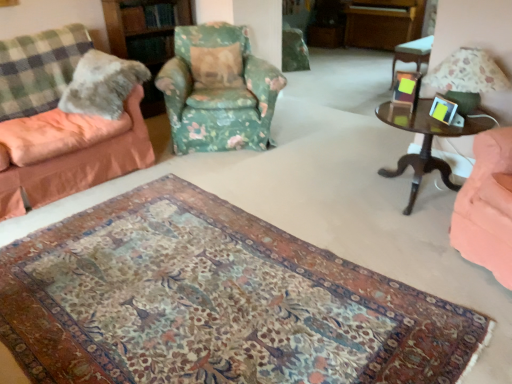
Question: Should I look upward or downward to see green checkered blanket at left?

Choices:
 (A) up
 (B) down

Answer: (A)

Question: Would you say green checkered blanket at left is outside fluffy fabric couch at left, which ranks as the second chair in right-to-left order?

Choices:
 (A) no
 (B) yes

Answer: (A)

Question: Is green checkered blanket at left further to camera compared to fluffy fabric couch at left, the first chair from the left?

Choices:
 (A) no
 (B) yes

Answer: (B)

Question: Considering the relative positions of green checkered blanket at left and fluffy fabric couch at left, which ranks as the second chair in right-to-left order, in the image provided, is green checkered blanket at left to the left of fluffy fabric couch at left, which ranks as the second chair in right-to-left order, from the viewer's perspective?

Choices:
 (A) no
 (B) yes

Answer: (B)

Question: From a real-world perspective, is green checkered blanket at left positioned under fluffy fabric couch at left, the first chair from the left, based on gravity?

Choices:
 (A) no
 (B) yes

Answer: (A)

Question: From a real-world perspective, is green checkered blanket at left over fluffy fabric couch at left, the first chair from the left?

Choices:
 (A) no
 (B) yes

Answer: (B)

Question: Is green checkered blanket at left at the right side of fluffy fabric couch at left, the first chair from the left?

Choices:
 (A) yes
 (B) no

Answer: (B)

Question: Can you confirm if green checkered blanket at left is shorter than green floral fabric bookshelf at upper center?

Choices:
 (A) no
 (B) yes

Answer: (B)

Question: Is green checkered blanket at left taller than green floral fabric bookshelf at upper center?

Choices:
 (A) no
 (B) yes

Answer: (A)

Question: Is green checkered blanket at left next to green floral fabric bookshelf at upper center and touching it?

Choices:
 (A) yes
 (B) no

Answer: (B)

Question: From the image's perspective, would you say green checkered blanket at left is positioned over green floral fabric bookshelf at upper center?

Choices:
 (A) no
 (B) yes

Answer: (A)

Question: From a real-world perspective, is green checkered blanket at left located higher than green floral fabric bookshelf at upper center?

Choices:
 (A) yes
 (B) no

Answer: (A)

Question: Is green checkered blanket at left at the right side of green floral fabric bookshelf at upper center?

Choices:
 (A) yes
 (B) no

Answer: (B)

Question: From the image's perspective, does dark wood side table at right, which is the second table in right-to-left order, appear lower than fluffy fabric couch at left, the first chair from the left?

Choices:
 (A) no
 (B) yes

Answer: (B)